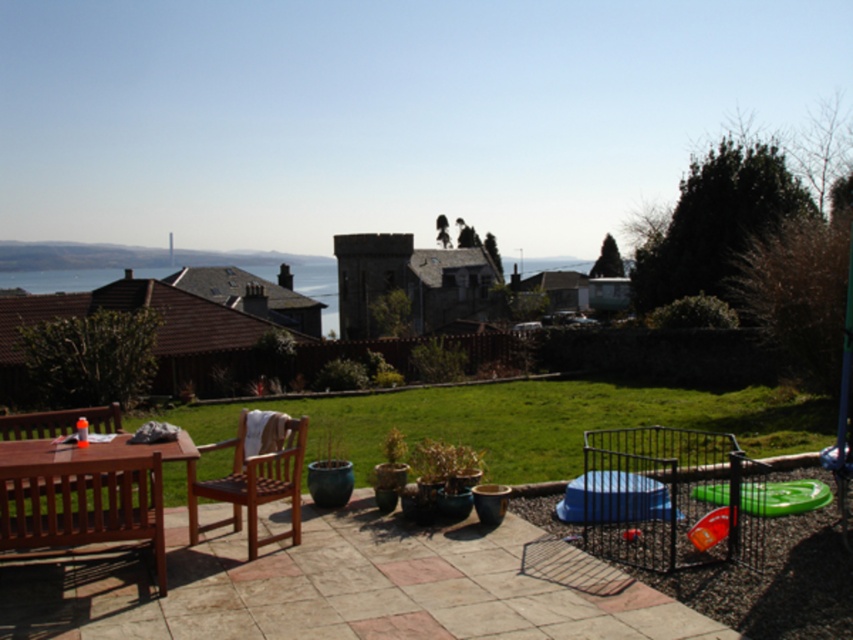
Between point (50, 531) and point (251, 552), which one is positioned behind?

Point (251, 552)

Can you confirm if wooden table at lower left is bigger than wooden chair at center?

Correct, wooden table at lower left is larger in size than wooden chair at center.

Find the location of `wooden table at lower left`. wooden table at lower left is located at coordinates click(88, 493).

Find the location of a particular element. wooden table at lower left is located at coordinates (88, 493).